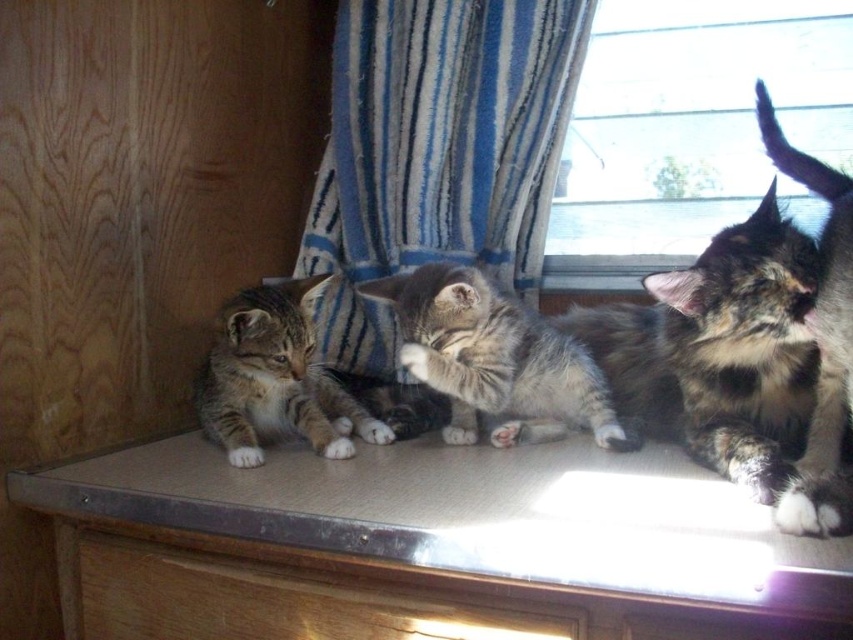
Question: Does calico fur cat at upper right have a greater width compared to gray tabby kitten at center?

Choices:
 (A) no
 (B) yes

Answer: (A)

Question: Which of these objects is positioned farthest from the blue striped fabric at center?

Choices:
 (A) calico fur cat at right
 (B) transparent glass window at upper right
 (C) gray tabby kitten at center

Answer: (A)

Question: Can you confirm if gray tabby kitten at center is positioned to the left of striped fur kitten at left?

Choices:
 (A) no
 (B) yes

Answer: (A)

Question: Which point is farther to the camera?

Choices:
 (A) wooden drawer at lower center
 (B) transparent glass window at upper right
 (C) striped fur kitten at left

Answer: (C)

Question: Which object is positioned farthest from the calico fur cat at right?

Choices:
 (A) wooden drawer at lower center
 (B) transparent glass window at upper right
 (C) calico fur cat at upper right
 (D) striped fur kitten at left

Answer: (D)

Question: Considering the relative positions of transparent glass window at upper right and gray tabby kitten at center in the image provided, where is transparent glass window at upper right located with respect to gray tabby kitten at center?

Choices:
 (A) left
 (B) right

Answer: (B)